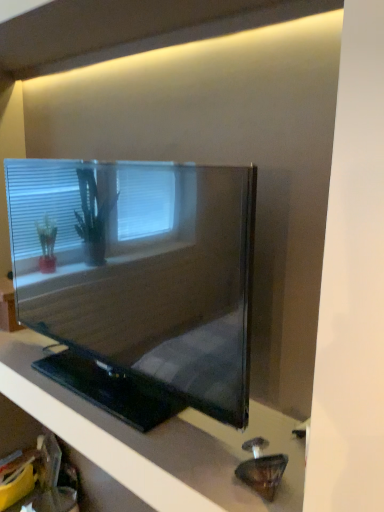
In order to click on matte black tv at center in this screenshot , I will do `click(138, 281)`.

What do you see at coordinates (138, 281) in the screenshot? This screenshot has width=384, height=512. I see `matte black tv at center` at bounding box center [138, 281].

The image size is (384, 512). In order to click on black glossy tv at center in this screenshot , I will do `click(156, 442)`.

What do you see at coordinates (156, 442) in the screenshot?
I see `black glossy tv at center` at bounding box center [156, 442].

This screenshot has height=512, width=384. I want to click on matte black tv at center, so click(138, 281).

Which is more to the right, matte black tv at center or black glossy tv at center?

matte black tv at center is more to the right.

Considering the positions of objects matte black tv at center and black glossy tv at center in the image provided, who is in front, matte black tv at center or black glossy tv at center?

Positioned in front is black glossy tv at center.

Which point is more distant from viewer, [155,208] or [233,486]?

Positioned behind is point [155,208].

From the image's perspective, is matte black tv at center located above or below black glossy tv at center?

matte black tv at center is above black glossy tv at center.

From a real-world perspective, is matte black tv at center on top of black glossy tv at center?

Indeed, from a real-world perspective, matte black tv at center stands above black glossy tv at center.

Is matte black tv at center thinner than black glossy tv at center?

Yes.

Which of these two, matte black tv at center or black glossy tv at center, stands shorter?

black glossy tv at center is shorter.

In the scene shown: Is matte black tv at center bigger than black glossy tv at center?

Indeed, matte black tv at center has a larger size compared to black glossy tv at center.

Is matte black tv at center inside the boundaries of black glossy tv at center, or outside?

The correct answer is: outside.

Are matte black tv at center and black glossy tv at center making contact?

No, matte black tv at center is not in contact with black glossy tv at center.

Is matte black tv at center facing away from black glossy tv at center?

matte black tv at center does not have its back to black glossy tv at center.

In the scene shown: How different are the orientations of matte black tv at center and black glossy tv at center in degrees?

There is a 0.000765-degree angle between the facing directions of matte black tv at center and black glossy tv at center.

Identify the location of furniture located underneath the matte black tv at center (from a real-world perspective). The height and width of the screenshot is (512, 384). (156, 442).

Is black glossy tv at center to the left or to the right of matte black tv at center in the image?

In the image, black glossy tv at center appears on the left side of matte black tv at center.

Which object is more forward, black glossy tv at center or matte black tv at center?

black glossy tv at center is in front.

Does point (156, 476) come closer to viewer compared to point (133, 249)?

Yes, point (156, 476) is closer to viewer.

From the image's perspective, is black glossy tv at center located above or below matte black tv at center?

From the image's perspective, black glossy tv at center appears below matte black tv at center.

From the picture: From a real-world perspective, is black glossy tv at center positioned above or below matte black tv at center?

Clearly, from a real-world perspective, black glossy tv at center is below matte black tv at center.

Consider the image. Which of these two, black glossy tv at center or matte black tv at center, is thinner?

matte black tv at center is thinner.

Between black glossy tv at center and matte black tv at center, which one has less height?

With less height is black glossy tv at center.

Considering the sizes of objects black glossy tv at center and matte black tv at center in the image provided, who is smaller, black glossy tv at center or matte black tv at center?

Smaller between the two is black glossy tv at center.

Is black glossy tv at center spatially inside matte black tv at center, or outside of it?

black glossy tv at center cannot be found inside matte black tv at center.

Is the surface of black glossy tv at center in direct contact with matte black tv at center?

No, black glossy tv at center is not touching matte black tv at center.

Could you tell me if black glossy tv at center is turned towards matte black tv at center?

No, black glossy tv at center is not oriented towards matte black tv at center.

The image size is (384, 512). In order to click on television behind the black glossy tv at center in this screenshot , I will do `click(138, 281)`.

This screenshot has width=384, height=512. What are the coordinates of `furniture in front of the matte black tv at center` in the screenshot? It's located at (156, 442).

Where is `furniture located below the matte black tv at center (from the image's perspective)`? The width and height of the screenshot is (384, 512). furniture located below the matte black tv at center (from the image's perspective) is located at coordinates (156, 442).